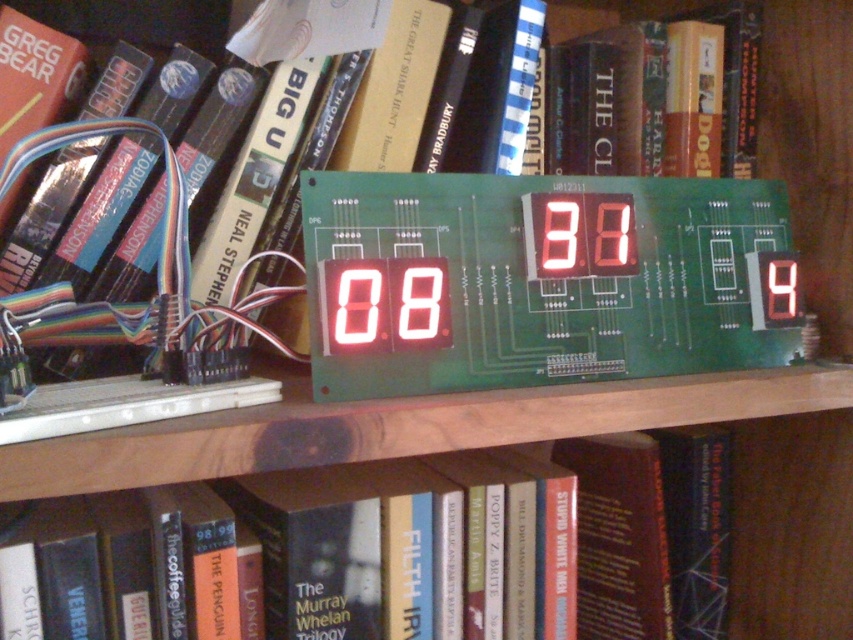
Based on the photo, can you confirm if hardcover book at center is positioned below white led display at center?

Yes.

Measure the distance from hardcover book at center to white led display at center.

hardcover book at center and white led display at center are 7.45 inches apart from each other.

Which is behind, point (173, 566) or point (393, 355)?

The point (393, 355) is more distant.

Locate an element on the screen. The width and height of the screenshot is (853, 640). hardcover book at center is located at coordinates (393, 548).